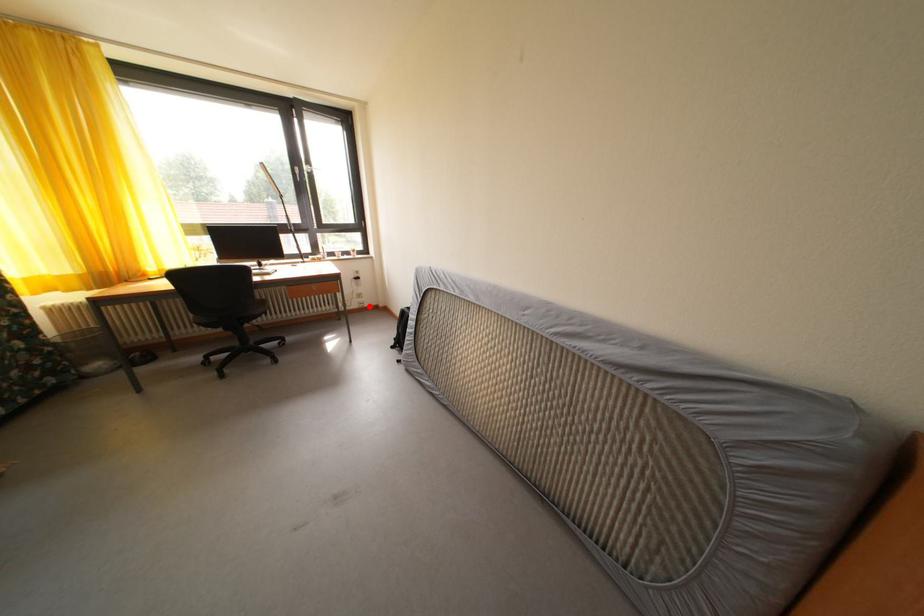
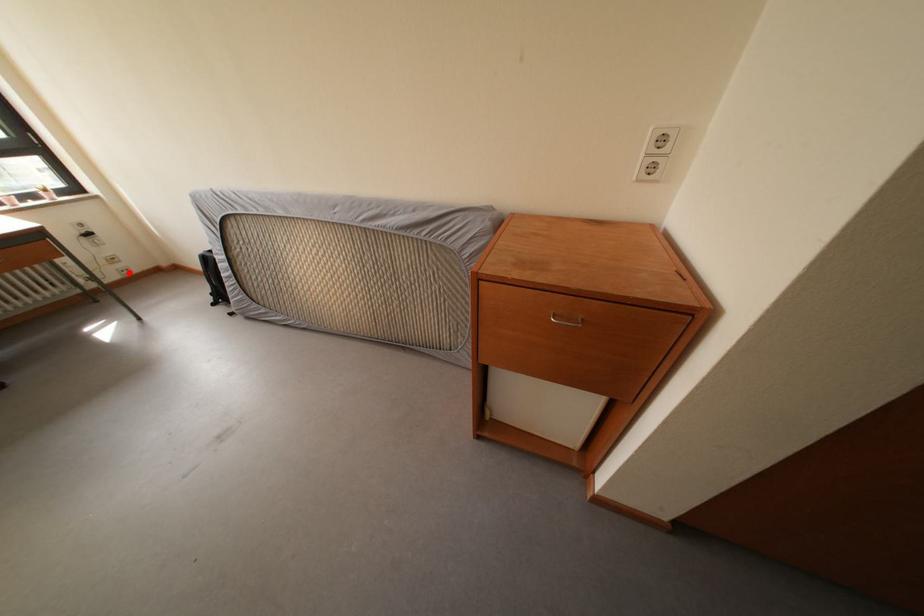
I am providing you with two images of the same scene from different viewpoints. A red point is marked on the first image and another point is marked on the second image. Does the point marked in image1 correspond to the same location as the one in image2?

Yes